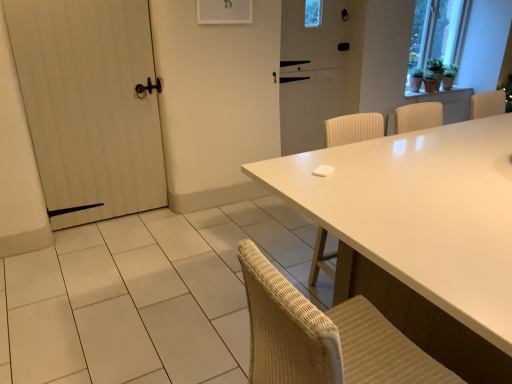
What are the coordinates of `free space above white wooden door at left (from a real-world perspective)` in the screenshot? It's located at coord(75,0).